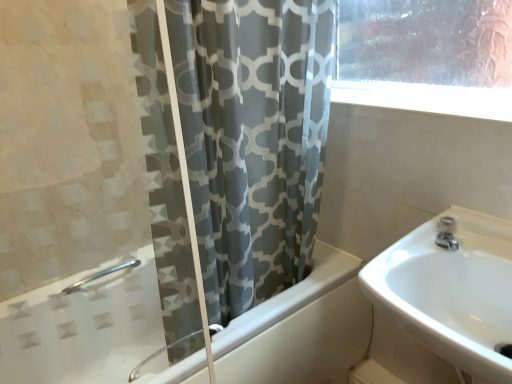
Question: Does satin nickel faucet at upper right have a greater height compared to white glossy bathtub at center?

Choices:
 (A) no
 (B) yes

Answer: (A)

Question: Can you confirm if satin nickel faucet at upper right is shorter than white glossy bathtub at center?

Choices:
 (A) no
 (B) yes

Answer: (B)

Question: Considering the relative sizes of satin nickel faucet at upper right and white glossy bathtub at center in the image provided, is satin nickel faucet at upper right smaller than white glossy bathtub at center?

Choices:
 (A) no
 (B) yes

Answer: (B)

Question: Considering the relative positions of satin nickel faucet at upper right and white glossy bathtub at center in the image provided, is satin nickel faucet at upper right in front of white glossy bathtub at center?

Choices:
 (A) no
 (B) yes

Answer: (A)

Question: Is satin nickel faucet at upper right not near white glossy bathtub at center?

Choices:
 (A) no
 (B) yes

Answer: (A)

Question: Is gray fabric curtain at center bigger or smaller than white glossy sink at right?

Choices:
 (A) big
 (B) small

Answer: (A)

Question: From a real-world perspective, is gray fabric curtain at center positioned above or below white glossy sink at right?

Choices:
 (A) above
 (B) below

Answer: (A)

Question: In the image, is gray fabric curtain at center positioned in front of or behind white glossy sink at right?

Choices:
 (A) front
 (B) behind

Answer: (B)

Question: From the image's perspective, is gray fabric curtain at center positioned above or below white glossy sink at right?

Choices:
 (A) below
 (B) above

Answer: (B)

Question: Considering the positions of satin nickel faucet at upper right and white glossy bathtub at center in the image, is satin nickel faucet at upper right bigger or smaller than white glossy bathtub at center?

Choices:
 (A) small
 (B) big

Answer: (A)

Question: Considering the positions of satin nickel faucet at upper right and white glossy bathtub at center in the image, is satin nickel faucet at upper right taller or shorter than white glossy bathtub at center?

Choices:
 (A) tall
 (B) short

Answer: (B)

Question: Does point (453, 236) appear closer or farther from the camera than point (246, 352)?

Choices:
 (A) farther
 (B) closer

Answer: (B)

Question: From the image's perspective, is satin nickel faucet at upper right located above or below white glossy bathtub at center?

Choices:
 (A) above
 (B) below

Answer: (A)

Question: Does point (411, 329) appear closer or farther from the camera than point (250, 213)?

Choices:
 (A) farther
 (B) closer

Answer: (B)

Question: Do you think white glossy sink at right is within gray fabric curtain at center, or outside of it?

Choices:
 (A) outside
 (B) inside

Answer: (A)